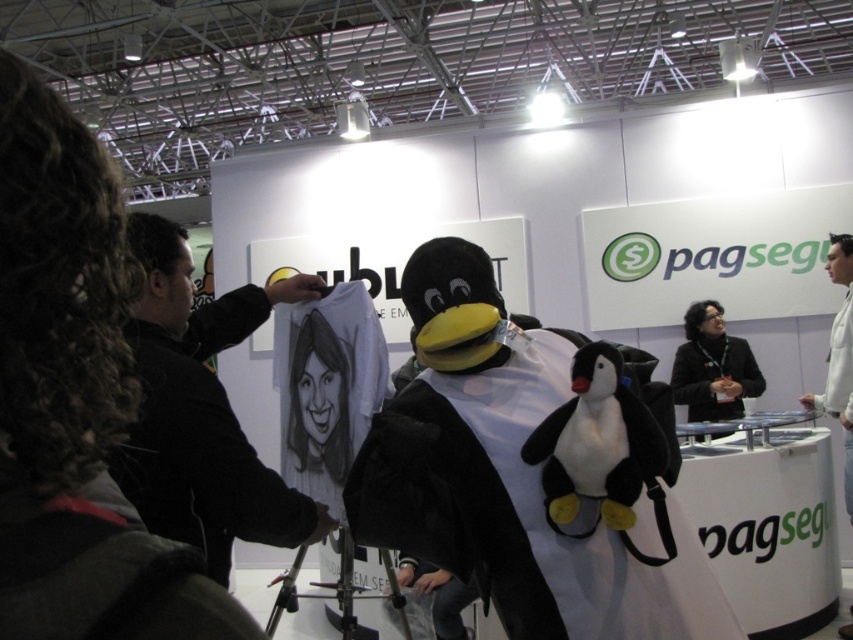
Is point (676, 602) farther from viewer compared to point (302, 292)?

No.

This screenshot has height=640, width=853. What do you see at coordinates (517, 509) in the screenshot?
I see `velvet black penguin at center` at bounding box center [517, 509].

Where is `velvet black penguin at center`? velvet black penguin at center is located at coordinates (517, 509).

Image resolution: width=853 pixels, height=640 pixels. In order to click on velvet black penguin at center in this screenshot , I will do `click(517, 509)`.

Does black plush penguin at center appear on the right side of black fabric at center?

No, black plush penguin at center is not to the right of black fabric at center.

Is black plush penguin at center closer to camera compared to black fabric at center?

Yes.

Does point (657, 472) come behind point (688, 353)?

That is False.

Locate an element on the screen. This screenshot has width=853, height=640. black plush penguin at center is located at coordinates (599, 448).

Is velvet black penguin at center above black fabric at center?

Indeed, velvet black penguin at center is positioned over black fabric at center.

You are a GUI agent. You are given a task and a screenshot of the screen. Output one action in this format:
    pyautogui.click(x=<x>, y=<y>)
    Task: Click on the velvet black penguin at center
    
    Given the screenshot: What is the action you would take?
    pyautogui.click(x=517, y=509)